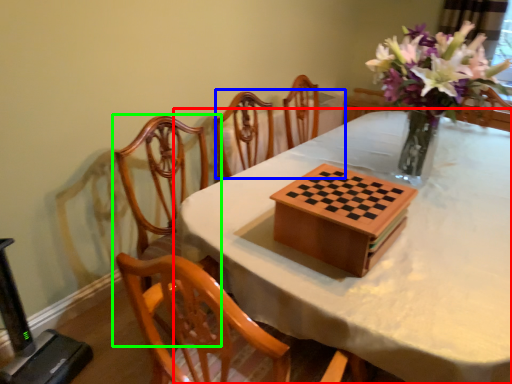
Question: Which object is the farthest from table (highlighted by a red box)? Choose among these: round table (highlighted by a blue box) or chair (highlighted by a green box).

Choices:
 (A) round table
 (B) chair

Answer: (A)